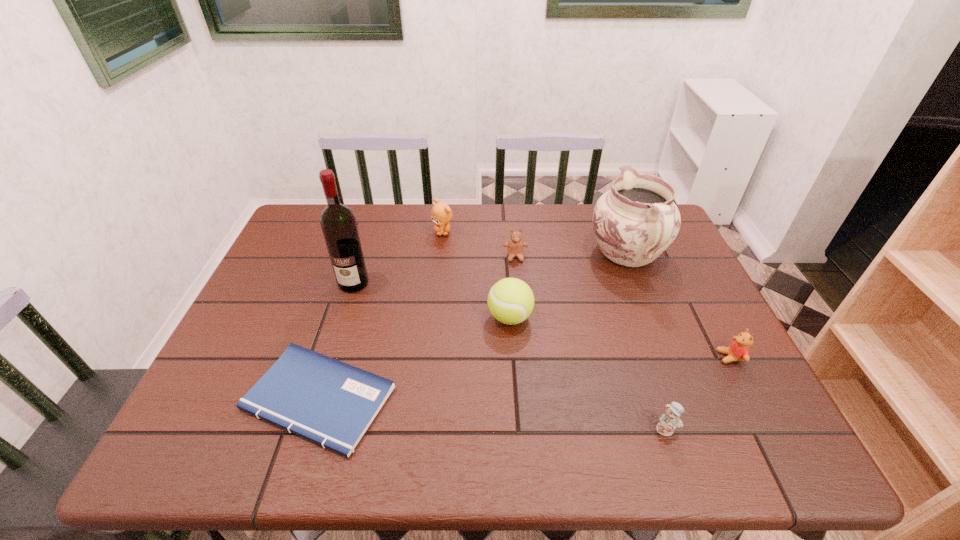
Locate an element on the screen. The image size is (960, 540). teddy bear that is at the far edge is located at coordinates click(441, 214).

Where is `teddy bear present at the near edge`? The height and width of the screenshot is (540, 960). teddy bear present at the near edge is located at coordinates (669, 421).

At what (x,y) coordinates should I click in order to perform the action: click on paperback book that is at the near edge. Please return your answer as a coordinate pair (x, y). Image resolution: width=960 pixels, height=540 pixels. Looking at the image, I should click on (331, 403).

The width and height of the screenshot is (960, 540). In order to click on object located at the left edge in this screenshot , I will do `click(331, 403)`.

At what (x,y) coordinates should I click in order to perform the action: click on pitcher that is at the right edge. Please return your answer as a coordinate pair (x, y). This screenshot has width=960, height=540. Looking at the image, I should click on [x=637, y=220].

Where is `teddy bear at the right edge`? teddy bear at the right edge is located at coordinates (738, 350).

The width and height of the screenshot is (960, 540). I want to click on object that is at the near left corner, so click(331, 403).

Identify the location of object that is at the far right corner. This screenshot has width=960, height=540. (637, 220).

Where is `vacant point at the far edge`? The width and height of the screenshot is (960, 540). vacant point at the far edge is located at coordinates (565, 225).

You are a GUI agent. You are given a task and a screenshot of the screen. Output one action in this format:
    pyautogui.click(x=<x>, y=<y>)
    Task: Click on the free space at the near edge
    
    Given the screenshot: What is the action you would take?
    pyautogui.click(x=400, y=443)